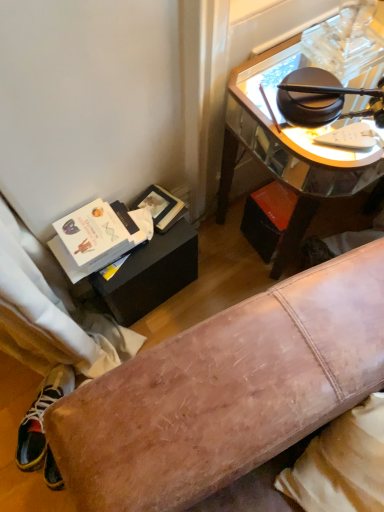
The image size is (384, 512). What do you see at coordinates (42, 424) in the screenshot?
I see `multicolored fabric shoe at lower left` at bounding box center [42, 424].

From the picture: Measure the distance between multicolored fabric shoe at lower left and camera.

A distance of 3.54 feet exists between multicolored fabric shoe at lower left and camera.

This screenshot has width=384, height=512. Find the location of `multicolored fabric shoe at lower left`. multicolored fabric shoe at lower left is located at coordinates (42, 424).

This screenshot has height=512, width=384. What are the coordinates of `shiny glass desk at upper right` in the screenshot? It's located at (300, 128).

Describe the element at coordinates (300, 128) in the screenshot. The width and height of the screenshot is (384, 512). I see `shiny glass desk at upper right` at that location.

What is the approximate width of shiny glass desk at upper right?

53.63 centimeters.

This screenshot has height=512, width=384. What are the coordinates of `multicolored fabric shoe at lower left` in the screenshot? It's located at (42, 424).

Considering the relative positions of shiny glass desk at upper right and multicolored fabric shoe at lower left in the image provided, is shiny glass desk at upper right to the left or to the right of multicolored fabric shoe at lower left?

Based on their positions, shiny glass desk at upper right is located to the right of multicolored fabric shoe at lower left.

Which object is closer to the camera taking this photo, shiny glass desk at upper right or multicolored fabric shoe at lower left?

shiny glass desk at upper right is in front.

Considering the points (379, 10) and (35, 444), which point is in front, point (379, 10) or point (35, 444)?

The point (379, 10) is more forward.

From the image's perspective, is shiny glass desk at upper right under multicolored fabric shoe at lower left?

No.

From the picture: From a real-world perspective, is shiny glass desk at upper right positioned above or below multicolored fabric shoe at lower left?

In terms of real-world spatial position, shiny glass desk at upper right is above multicolored fabric shoe at lower left.

Considering the relative sizes of shiny glass desk at upper right and multicolored fabric shoe at lower left in the image provided, is shiny glass desk at upper right wider than multicolored fabric shoe at lower left?

Indeed, shiny glass desk at upper right has a greater width compared to multicolored fabric shoe at lower left.

Does shiny glass desk at upper right have a greater height compared to multicolored fabric shoe at lower left?

Yes.

Considering the relative sizes of shiny glass desk at upper right and multicolored fabric shoe at lower left in the image provided, is shiny glass desk at upper right bigger than multicolored fabric shoe at lower left?

Yes, shiny glass desk at upper right is bigger than multicolored fabric shoe at lower left.

Can multicolored fabric shoe at lower left be found inside shiny glass desk at upper right?

No, multicolored fabric shoe at lower left is not a part of shiny glass desk at upper right.

Are shiny glass desk at upper right and multicolored fabric shoe at lower left beside each other?

No, shiny glass desk at upper right is not with multicolored fabric shoe at lower left.

Is shiny glass desk at upper right oriented away from multicolored fabric shoe at lower left?

No, shiny glass desk at upper right is not facing the opposite direction of multicolored fabric shoe at lower left.

How many degrees apart are the facing directions of shiny glass desk at upper right and multicolored fabric shoe at lower left?

40.9 degrees.

This screenshot has width=384, height=512. I want to click on shoe that is on the left side of shiny glass desk at upper right, so click(x=42, y=424).

Can you confirm if multicolored fabric shoe at lower left is positioned to the left of shiny glass desk at upper right?

Correct, you'll find multicolored fabric shoe at lower left to the left of shiny glass desk at upper right.

Who is more distant, multicolored fabric shoe at lower left or shiny glass desk at upper right?

multicolored fabric shoe at lower left.

Is point (71, 370) less distant than point (333, 159)?

No, (71, 370) is behind (333, 159).

From the image's perspective, who appears lower, multicolored fabric shoe at lower left or shiny glass desk at upper right?

multicolored fabric shoe at lower left appears lower in the image.

From a real-world perspective, which is physically above, multicolored fabric shoe at lower left or shiny glass desk at upper right?

shiny glass desk at upper right, from a real-world perspective.

Does multicolored fabric shoe at lower left have a greater width compared to shiny glass desk at upper right?

In fact, multicolored fabric shoe at lower left might be narrower than shiny glass desk at upper right.

Which of these two, multicolored fabric shoe at lower left or shiny glass desk at upper right, stands taller?

shiny glass desk at upper right.

Between multicolored fabric shoe at lower left and shiny glass desk at upper right, which one has larger size?

shiny glass desk at upper right.

Is multicolored fabric shoe at lower left completely or partially outside of shiny glass desk at upper right?

multicolored fabric shoe at lower left lies outside shiny glass desk at upper right's area.

Based on the photo, is multicolored fabric shoe at lower left with shiny glass desk at upper right?

No, multicolored fabric shoe at lower left is not next to shiny glass desk at upper right.

Is multicolored fabric shoe at lower left turned away from shiny glass desk at upper right?

multicolored fabric shoe at lower left is not turned away from shiny glass desk at upper right.

How different are the orientations of multicolored fabric shoe at lower left and shiny glass desk at upper right in degrees?

multicolored fabric shoe at lower left and shiny glass desk at upper right are facing 40.9 degrees away from each other.

The width and height of the screenshot is (384, 512). Find the location of `desk in front of the multicolored fabric shoe at lower left`. desk in front of the multicolored fabric shoe at lower left is located at coordinates (300, 128).

I want to click on shoe below the shiny glass desk at upper right (from the image's perspective), so click(42, 424).

This screenshot has width=384, height=512. I want to click on shoe that appears on the left of shiny glass desk at upper right, so click(42, 424).